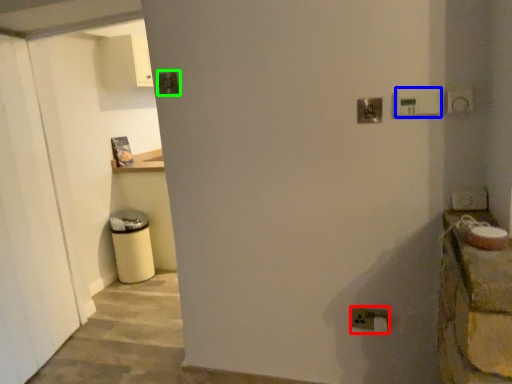
Question: Which is nearer to the electric outlet (highlighted by a red box)? light switch (highlighted by a blue box) or light switch (highlighted by a green box).

Choices:
 (A) light switch
 (B) light switch

Answer: (A)